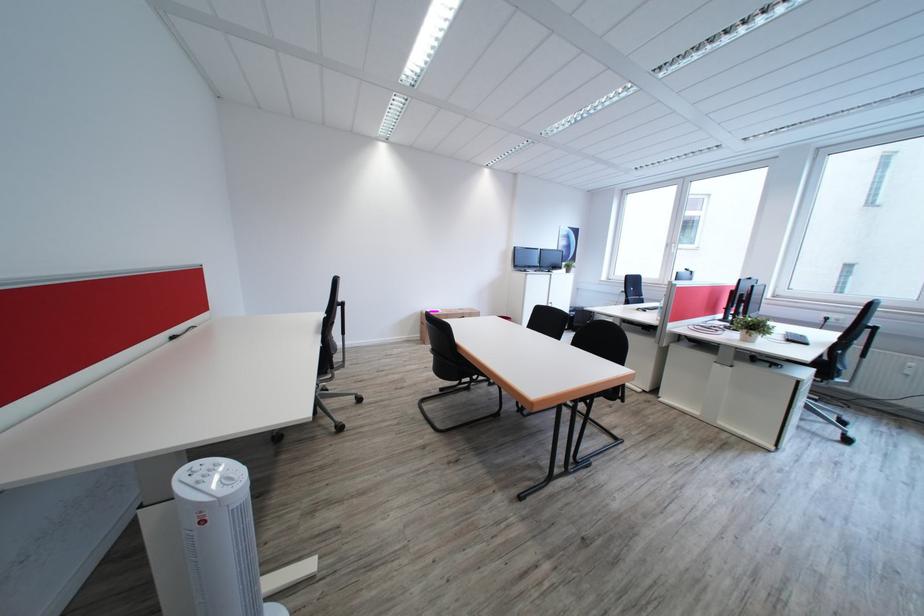
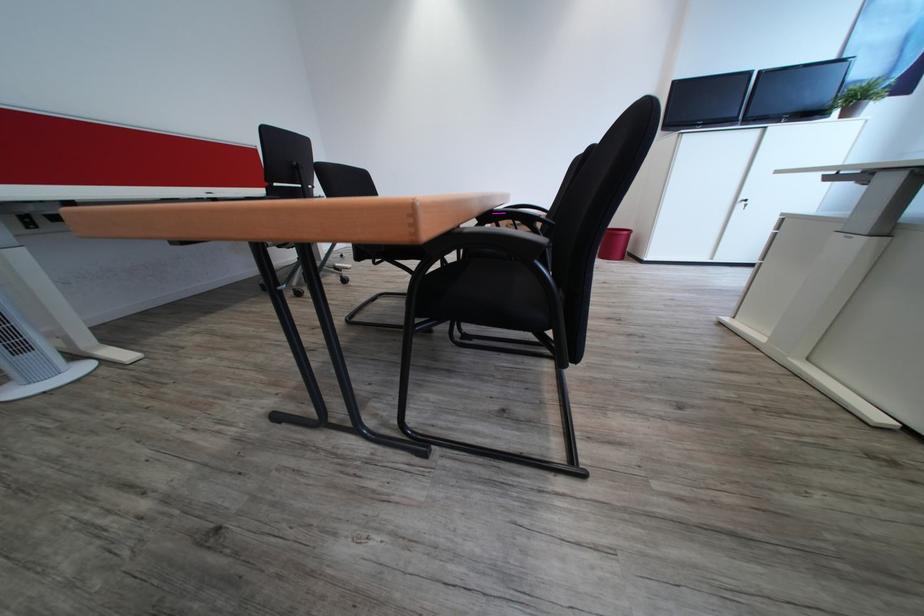
Where in the second image is the point corresponding to (x=575, y=272) from the first image?

(845, 116)